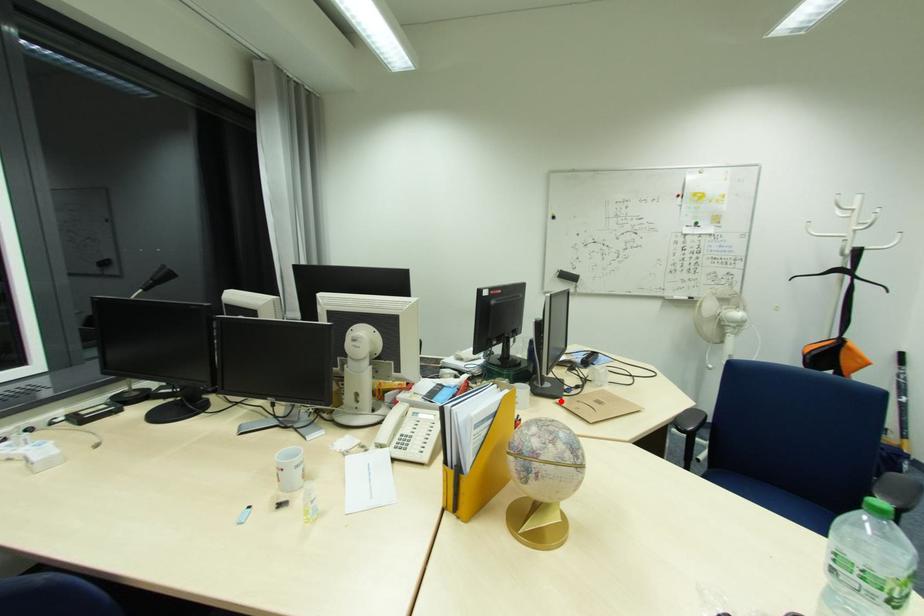
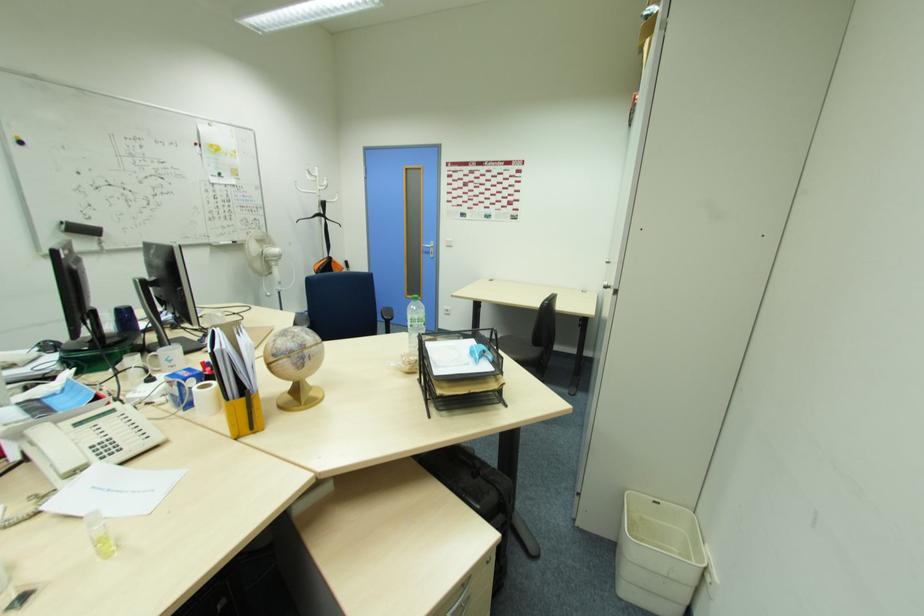
Where in the second image is the point corresponding to the highlighted location from the first image?

(209, 351)